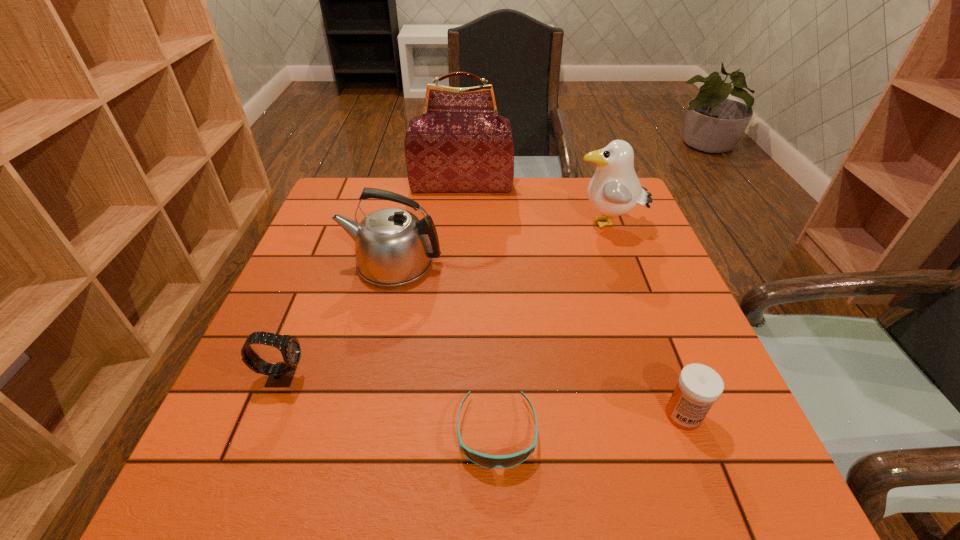
The image size is (960, 540). In order to click on vacant space that satisfies the following two spatial constraints: 1. on the beak of the gull; 2. on the back side of the medicine in this screenshot , I will do `click(677, 415)`.

Where is `free space that satisfies the following two spatial constraints: 1. on the face of the medicine; 2. on the left side of the fourth farthest object`? This screenshot has width=960, height=540. free space that satisfies the following two spatial constraints: 1. on the face of the medicine; 2. on the left side of the fourth farthest object is located at coordinates (267, 415).

This screenshot has height=540, width=960. Identify the location of vacant area that satisfies the following two spatial constraints: 1. on the back side of the medicine; 2. on the spout of the fourth shortest object. (626, 264).

Identify the location of blank area in the image that satisfies the following two spatial constraints: 1. on the beak of the gull; 2. on the front-facing side of the sunglasses. The height and width of the screenshot is (540, 960). (684, 433).